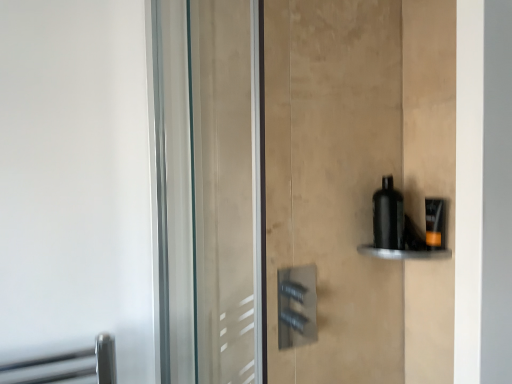
Question: Is matte black bottle at right inside or outside of black matte bottle at right?

Choices:
 (A) outside
 (B) inside

Answer: (A)

Question: From the image's perspective, relative to black matte bottle at right, is matte black bottle at right above or below?

Choices:
 (A) below
 (B) above

Answer: (A)

Question: Which is nearer to the matte black bottle at right?

Choices:
 (A) black matte bottle at right
 (B) black glossy bottle at right

Answer: (B)

Question: Which is nearer to the matte black bottle at right?

Choices:
 (A) black matte bottle at right
 (B) black glossy bottle at right

Answer: (B)